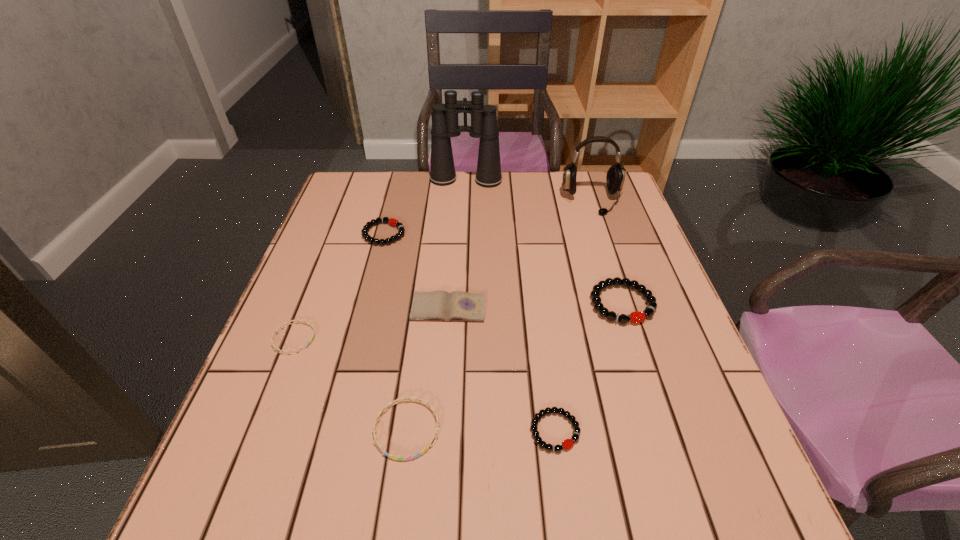
Where is `binoculars`? The width and height of the screenshot is (960, 540). binoculars is located at coordinates (484, 125).

I want to click on headset, so click(x=615, y=177).

Image resolution: width=960 pixels, height=540 pixels. Find the location of `the tallest bracelet`. the tallest bracelet is located at coordinates (636, 317).

This screenshot has height=540, width=960. Identify the location of the biggest black bracelet. (636, 317).

Where is `the farthest black bracelet`? This screenshot has height=540, width=960. the farthest black bracelet is located at coordinates (393, 222).

I want to click on the sixth nearest object, so (x=393, y=222).

At what (x,y) coordinates should I click in order to perform the action: click on diary. Please return your answer as a coordinate pair (x, y). The height and width of the screenshot is (540, 960). Looking at the image, I should click on (438, 305).

Locate an element on the screen. The width and height of the screenshot is (960, 540). the nearer blue bracelet is located at coordinates (420, 400).

Identify the location of the right blue bracelet. This screenshot has height=540, width=960. (420, 400).

At what (x,y) coordinates should I click in order to perform the action: click on the third object from right to left. Please return your answer as a coordinate pair (x, y). This screenshot has width=960, height=540. Looking at the image, I should click on (568, 443).